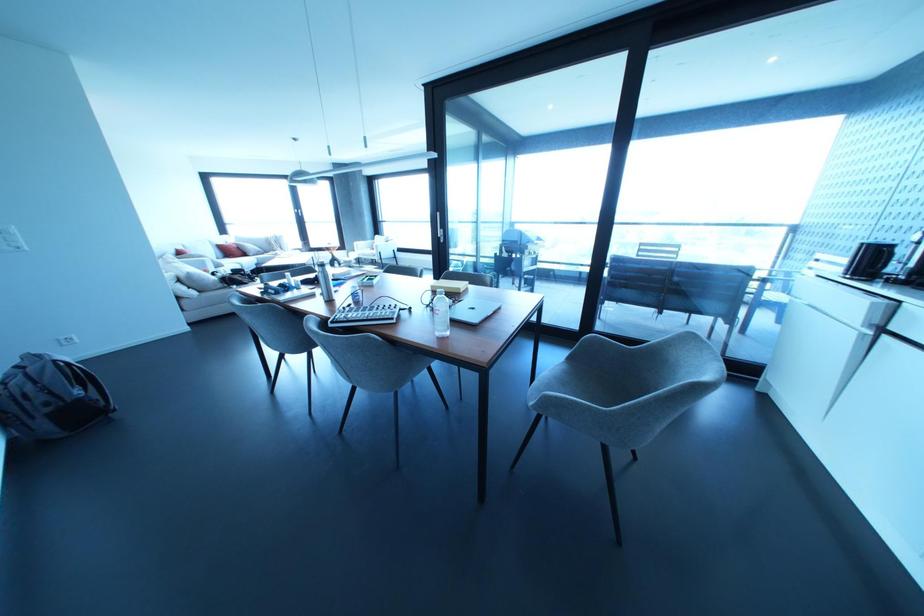
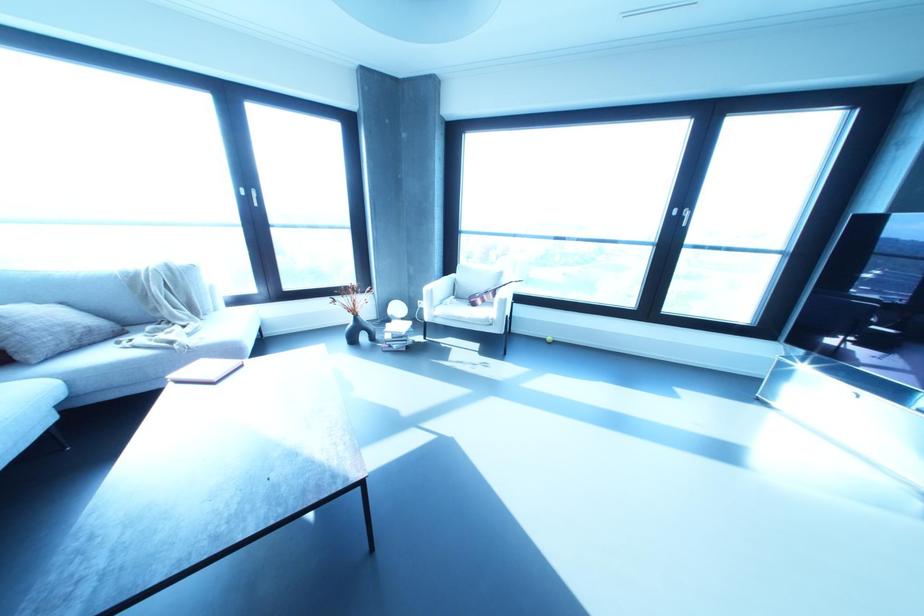
Locate, in the second image, the point that corresponds to (354,243) in the first image.

(426, 288)